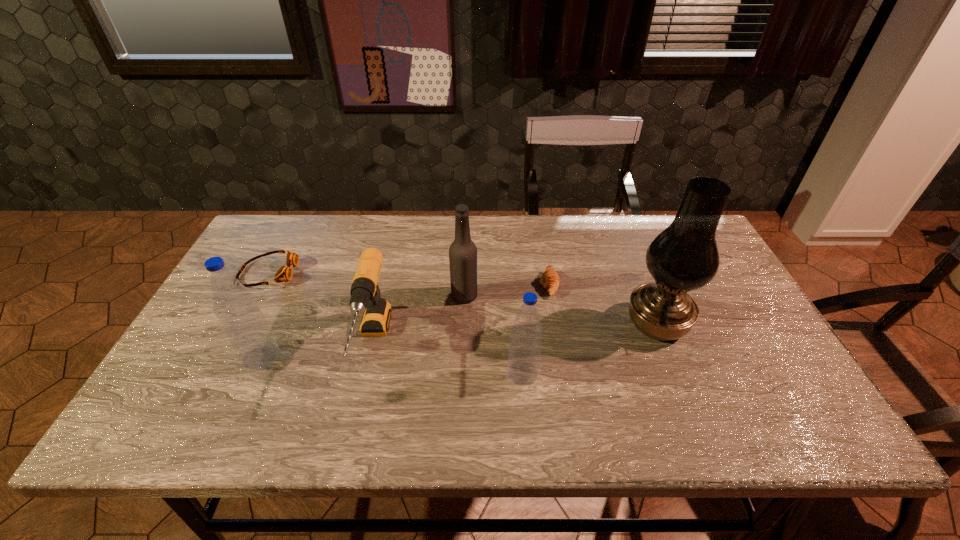
The image size is (960, 540). I want to click on free space located 0.250m on the back of the taller water bottle, so click(x=298, y=276).

Locate an element on the screen. free spot located 0.240m on the right of the fifth object from left to right is located at coordinates (640, 373).

Find the location of a particular element. vacant space located 0.160m on the label of the fourth object from right to left is located at coordinates (535, 295).

Where is `free spot located 0.300m on the back of the rightmost object`? free spot located 0.300m on the back of the rightmost object is located at coordinates (622, 235).

Where is `vacant space situated with the lenses facing forward on the goggles`? vacant space situated with the lenses facing forward on the goggles is located at coordinates (313, 273).

You are a GUI agent. You are given a task and a screenshot of the screen. Output one action in this format:
    pyautogui.click(x=<x>, y=<y>)
    Task: Click on the free location located on the front-facing side of the second object from right to left
    The height and width of the screenshot is (540, 960).
    Given the screenshot: What is the action you would take?
    tap(505, 285)

This screenshot has height=540, width=960. In order to click on vacant space located 0.220m on the front-facing side of the second object from right to left in this screenshot , I will do `click(463, 285)`.

You are a GUI agent. You are given a task and a screenshot of the screen. Output one action in this format:
    pyautogui.click(x=<x>, y=<y>)
    Task: Click on the vacant space located on the front-facing side of the second object from right to left
    
    Given the screenshot: What is the action you would take?
    (427, 285)

Find the location of a particular element. object that is at the far edge is located at coordinates (284, 273).

Locate an element on the screen. Image resolution: width=960 pixels, height=540 pixels. drill that is at the near edge is located at coordinates (365, 294).